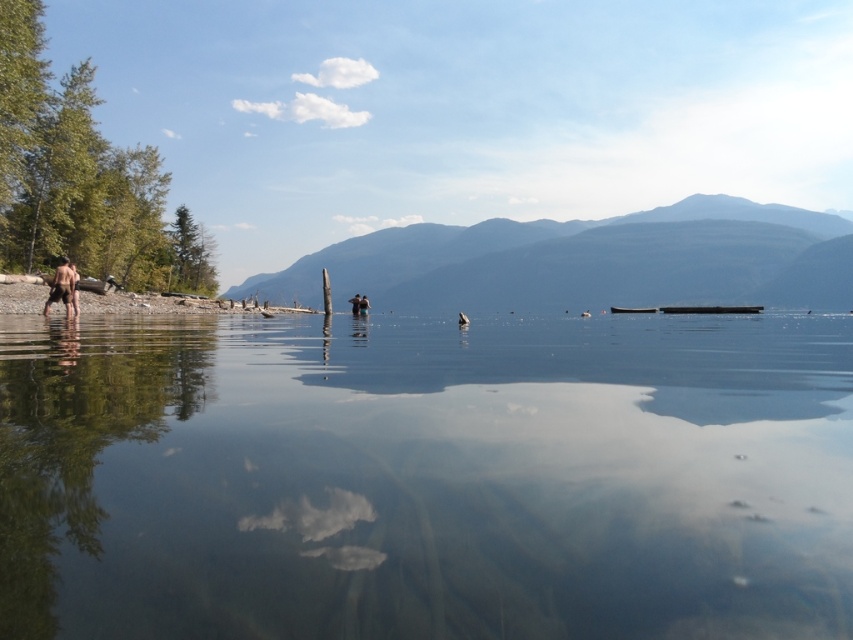
Can you confirm if clear water at center is bigger than brown wood at left?

No, clear water at center is not bigger than brown wood at left.

Does clear water at center appear on the right side of brown wood at left?

Indeed, clear water at center is positioned on the right side of brown wood at left.

Between point (796, 532) and point (91, 298), which one is positioned in front?

Point (796, 532)

Locate an element on the screen. This screenshot has height=640, width=853. clear water at center is located at coordinates (426, 480).

Who is taller, brown wood at left or smooth skin person at center?

brown wood at left

Which of these two, brown wood at left or smooth skin person at center, stands shorter?

smooth skin person at center is shorter.

The width and height of the screenshot is (853, 640). In order to click on brown wood at left in this screenshot , I will do `click(140, 301)`.

In the scene shown: Is brown wood at left taller than brown skin at left?

Yes, brown wood at left is taller than brown skin at left.

Describe the element at coordinates (140, 301) in the screenshot. The width and height of the screenshot is (853, 640). I see `brown wood at left` at that location.

Is point (32, 282) farther from viewer compared to point (71, 275)?

Yes, it is behind point (71, 275).

Locate an element on the screen. This screenshot has width=853, height=640. brown wood at left is located at coordinates (140, 301).